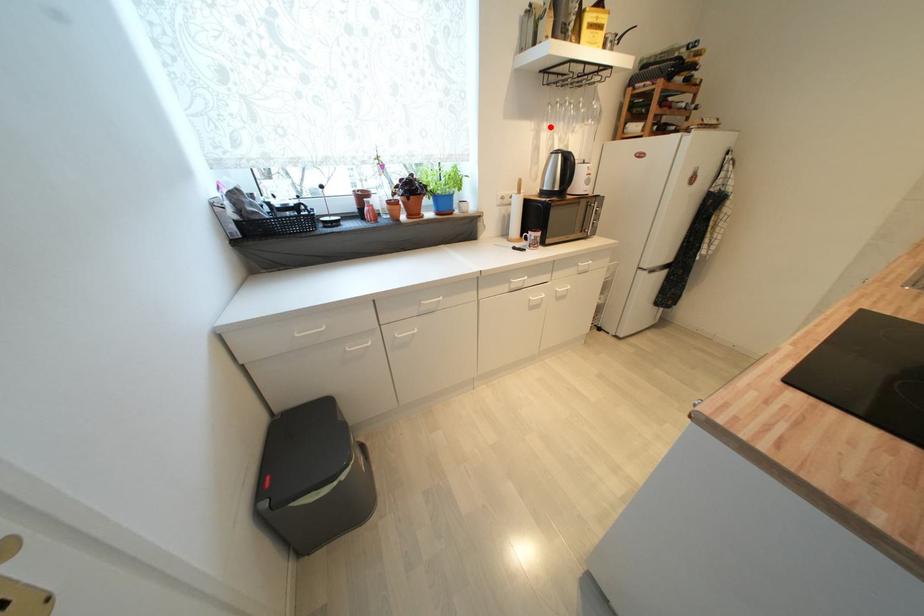
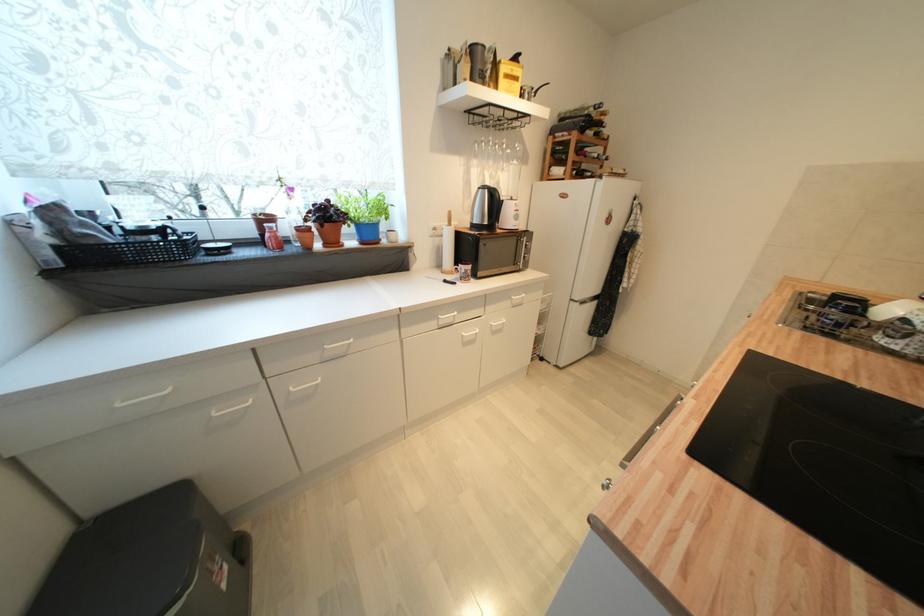
Question: I am providing you with two images of the same scene from different viewpoints. A red point is marked on the first image. Is the red point's position out of view in image 2?

Choices:
 (A) Yes
 (B) No

Answer: (B)